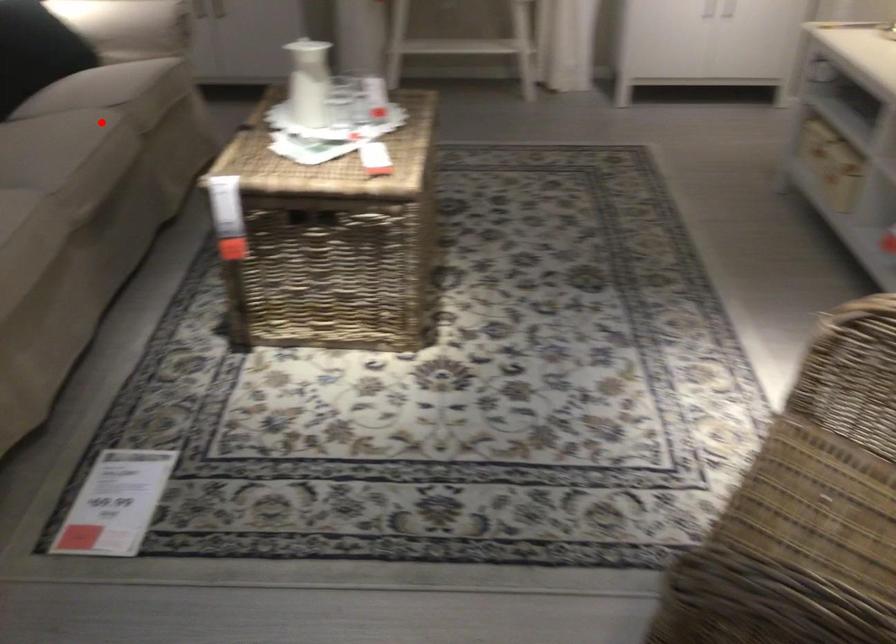
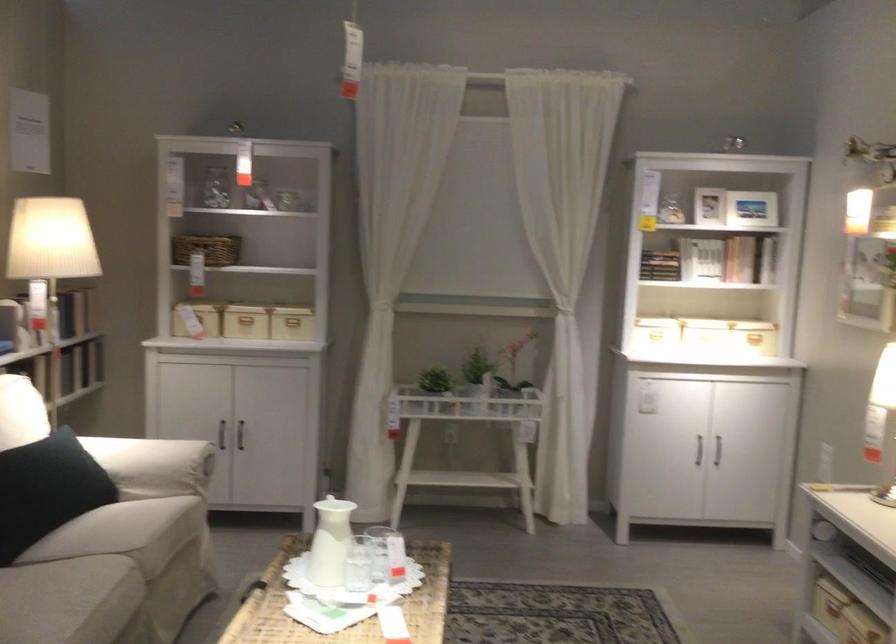
Where in the second image is the point corresponding to the highlighted location from the first image?

(110, 576)